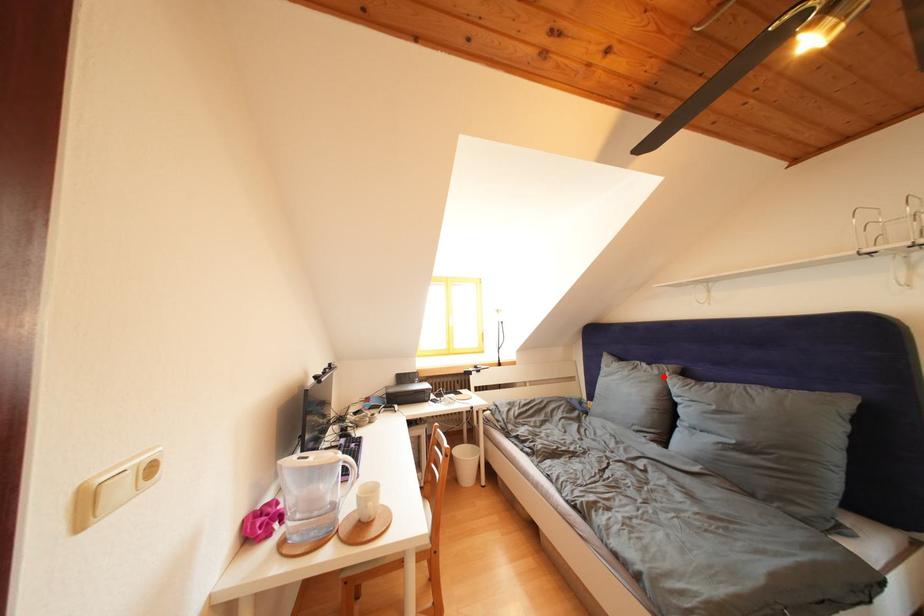
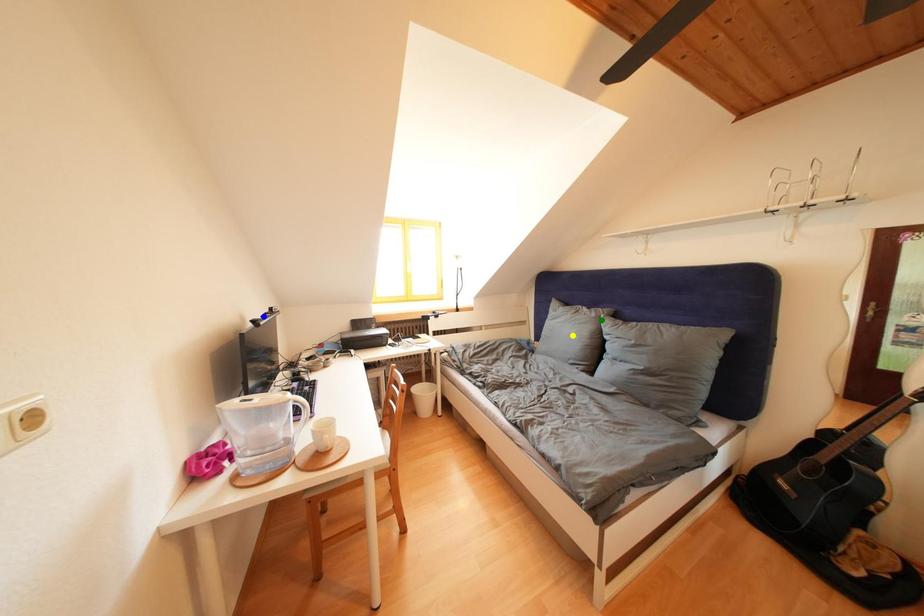
Question: I am providing you with two images of the same scene from different viewpoints. A red point is marked on the first image. You are given multiple points on the second image. In image 2, which mark is for the same physical point as the one in image 1?

Choices:
 (A) blue point
 (B) green point
 (C) yellow point

Answer: (B)